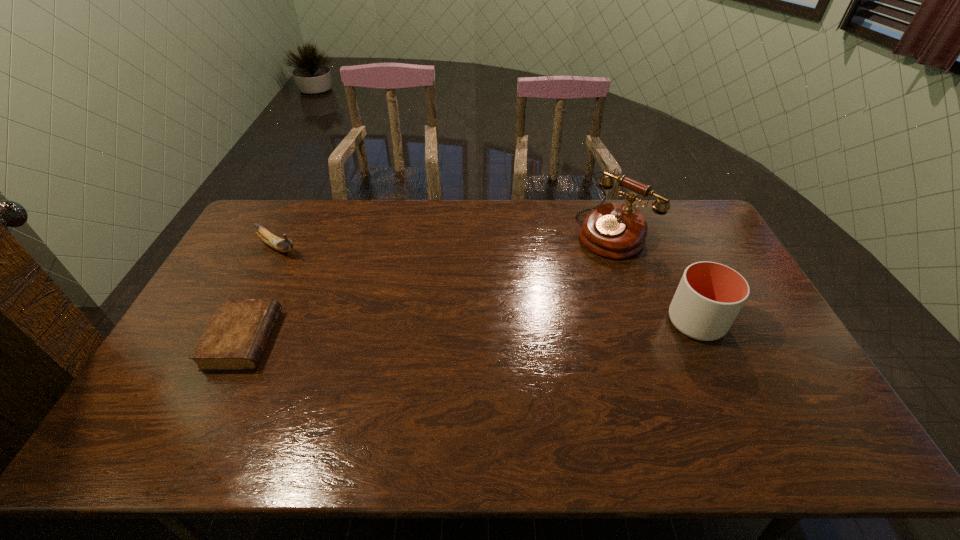
In order to click on free space on the desktop that is between the diary and the third shortest object and is positioned at the stem of the banana in this screenshot , I will do `click(414, 333)`.

Image resolution: width=960 pixels, height=540 pixels. What are the coordinates of `vacant space on the desktop that is between the diary and the second tallest object and is positioned on the dial of the tallest object` in the screenshot? It's located at (490, 330).